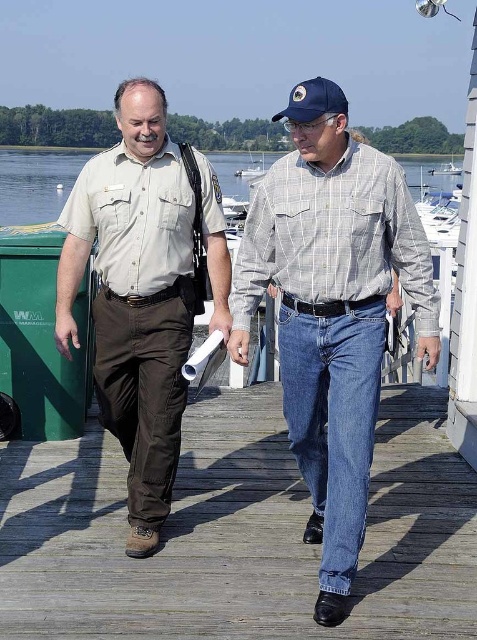
Is point (237, 620) behind point (262, 160)?

No, (237, 620) is closer to viewer.

Who is higher up, wooden at center or white plastic boat at center?

white plastic boat at center is higher up.

I want to click on wooden at center, so click(238, 532).

Is point (323, 211) positioned behind point (145, 323)?

No, it is not.

Can you confirm if gray checkered shirt at center is smaller than khaki uniform shirt at center?

Actually, gray checkered shirt at center might be larger than khaki uniform shirt at center.

The width and height of the screenshot is (477, 640). What are the coordinates of `gray checkered shirt at center` in the screenshot? It's located at (331, 310).

Which of these two, gray checkered shirt at center or clear water at center, stands shorter?

Standing shorter between the two is gray checkered shirt at center.

In the scene shown: Does gray checkered shirt at center have a lesser width compared to clear water at center?

Correct, gray checkered shirt at center's width is less than clear water at center's.

Who is more distant from viewer, (346, 106) or (0, 205)?

Point (0, 205)

Where is `gray checkered shirt at center`? The height and width of the screenshot is (640, 477). gray checkered shirt at center is located at coordinates pyautogui.click(x=331, y=310).